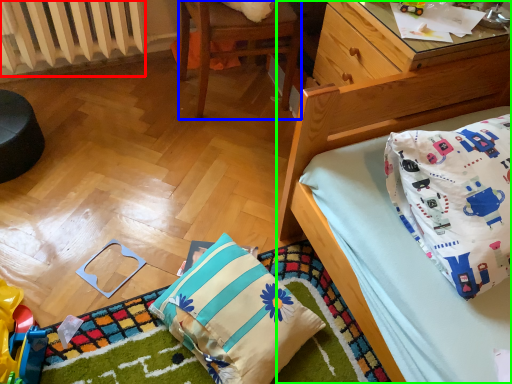
Question: Estimate the real-world distances between objects in this image. Which object is farther from radiator (highlighted by a red box), chair (highlighted by a blue box) or bed (highlighted by a green box)?

Choices:
 (A) chair
 (B) bed

Answer: (B)